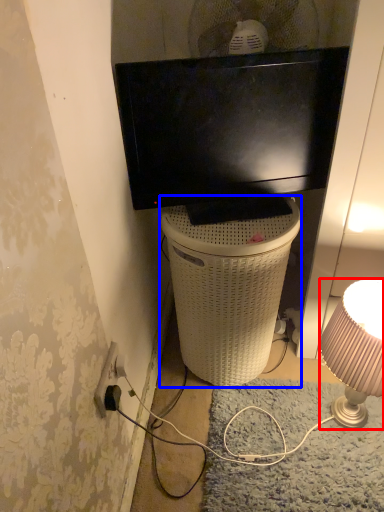
Question: Which point is closer to the camera, lamp (highlighted by a red box) or trash bin/can (highlighted by a blue box)?

Choices:
 (A) lamp
 (B) trash bin/can

Answer: (A)